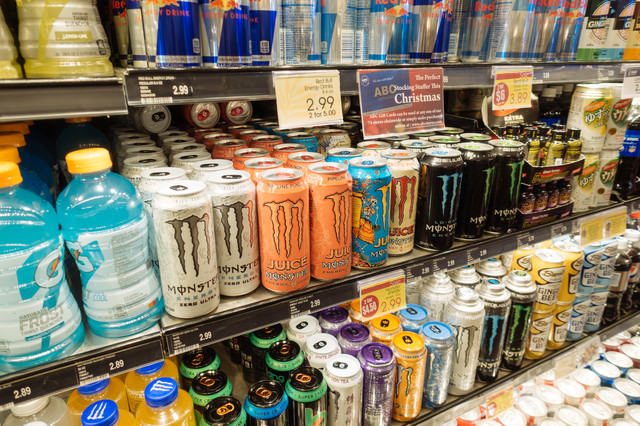
In order to click on separate shelves in this screenshot , I will do `click(44, 92)`, `click(225, 83)`, `click(70, 361)`, `click(380, 270)`, `click(488, 388)`.